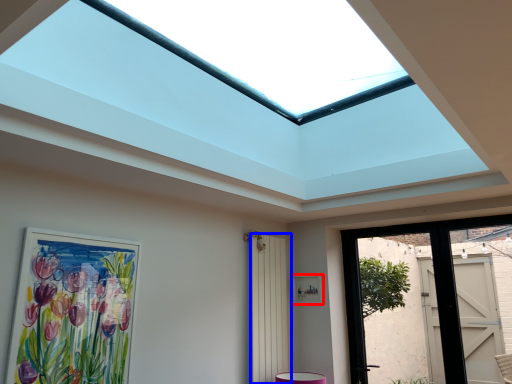
Question: Which of the following is the closest to the observer, picture frame (highlighted by a red box) or screen door (highlighted by a blue box)?

Choices:
 (A) picture frame
 (B) screen door

Answer: (B)